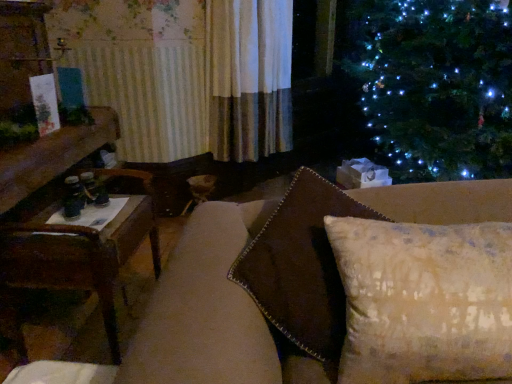
Question: From a real-world perspective, is textured beige pillow at center above or below brown wooden table at left?

Choices:
 (A) above
 (B) below

Answer: (A)

Question: Based on their positions, is textured beige pillow at center located to the left or right of brown wooden table at left?

Choices:
 (A) right
 (B) left

Answer: (A)

Question: Is point (400, 362) positioned closer to the camera than point (158, 236)?

Choices:
 (A) closer
 (B) farther

Answer: (A)

Question: Looking at the image, does brown wooden table at left seem bigger or smaller compared to textured beige pillow at center?

Choices:
 (A) big
 (B) small

Answer: (A)

Question: Does point (99, 269) appear closer or farther from the camera than point (466, 286)?

Choices:
 (A) farther
 (B) closer

Answer: (A)

Question: In the image, is brown wooden table at left on the left side or the right side of textured beige pillow at center?

Choices:
 (A) right
 (B) left

Answer: (B)

Question: Considering the positions of brown wooden table at left and textured beige pillow at center in the image, is brown wooden table at left wider or thinner than textured beige pillow at center?

Choices:
 (A) wide
 (B) thin

Answer: (A)